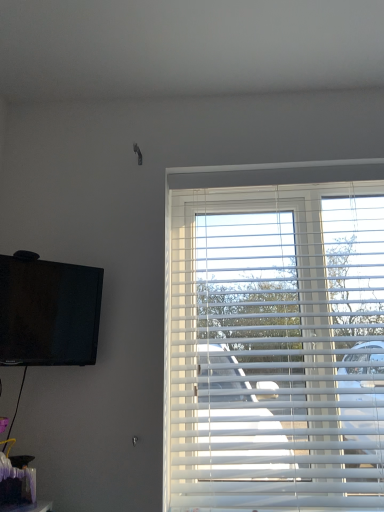
Question: From the image's perspective, is matte black tv at upper left positioned above or below white plastic blinds at right?

Choices:
 (A) above
 (B) below

Answer: (A)

Question: Do you think matte black tv at upper left is within white plastic blinds at right, or outside of it?

Choices:
 (A) inside
 (B) outside

Answer: (B)

Question: From their relative heights in the image, would you say matte black tv at upper left is taller or shorter than white plastic blinds at right?

Choices:
 (A) short
 (B) tall

Answer: (A)

Question: From the image's perspective, is white plastic blinds at right located above or below matte black tv at upper left?

Choices:
 (A) above
 (B) below

Answer: (B)

Question: Do you think white plastic blinds at right is within matte black tv at upper left, or outside of it?

Choices:
 (A) outside
 (B) inside

Answer: (A)

Question: Is white plastic blinds at right taller or shorter than matte black tv at upper left?

Choices:
 (A) tall
 (B) short

Answer: (A)

Question: Looking at their shapes, would you say white plastic blinds at right is wider or thinner than matte black tv at upper left?

Choices:
 (A) wide
 (B) thin

Answer: (A)